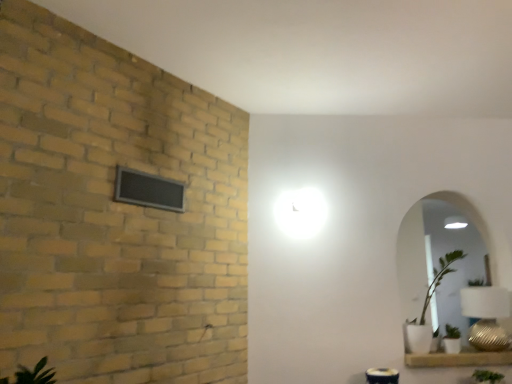
Question: Does white ceramic window sill at lower right contain black mesh window at upper left?

Choices:
 (A) no
 (B) yes

Answer: (A)

Question: From a real-world perspective, is white ceramic window sill at lower right beneath black mesh window at upper left?

Choices:
 (A) yes
 (B) no

Answer: (A)

Question: Does white ceramic window sill at lower right have a greater height compared to black mesh window at upper left?

Choices:
 (A) yes
 (B) no

Answer: (B)

Question: From the image's perspective, is white ceramic window sill at lower right above black mesh window at upper left?

Choices:
 (A) yes
 (B) no

Answer: (B)

Question: Does white ceramic window sill at lower right lie behind black mesh window at upper left?

Choices:
 (A) yes
 (B) no

Answer: (A)

Question: Considering their positions, is green leafy plant at lower right located in front of or behind white ceramic window sill at lower right?

Choices:
 (A) behind
 (B) front

Answer: (B)

Question: Is green leafy plant at lower right taller or shorter than white ceramic window sill at lower right?

Choices:
 (A) short
 (B) tall

Answer: (B)

Question: Which is correct: green leafy plant at lower right is inside white ceramic window sill at lower right, or outside of it?

Choices:
 (A) outside
 (B) inside

Answer: (A)

Question: Based on their sizes in the image, would you say green leafy plant at lower right is bigger or smaller than white ceramic window sill at lower right?

Choices:
 (A) big
 (B) small

Answer: (B)

Question: Based on their positions, is gold textured table lamp at lower right located to the left or right of white ceramic window sill at lower right?

Choices:
 (A) left
 (B) right

Answer: (B)

Question: In the image, is gold textured table lamp at lower right positioned in front of or behind white ceramic window sill at lower right?

Choices:
 (A) front
 (B) behind

Answer: (B)

Question: From a real-world perspective, is gold textured table lamp at lower right physically located above or below white ceramic window sill at lower right?

Choices:
 (A) above
 (B) below

Answer: (A)

Question: Is gold textured table lamp at lower right wider or thinner than white ceramic window sill at lower right?

Choices:
 (A) thin
 (B) wide

Answer: (A)

Question: Is white ceramic window sill at lower right situated inside green leafy plant at lower right or outside?

Choices:
 (A) outside
 (B) inside

Answer: (A)

Question: From the image's perspective, is white ceramic window sill at lower right located above or below green leafy plant at lower right?

Choices:
 (A) above
 (B) below

Answer: (A)